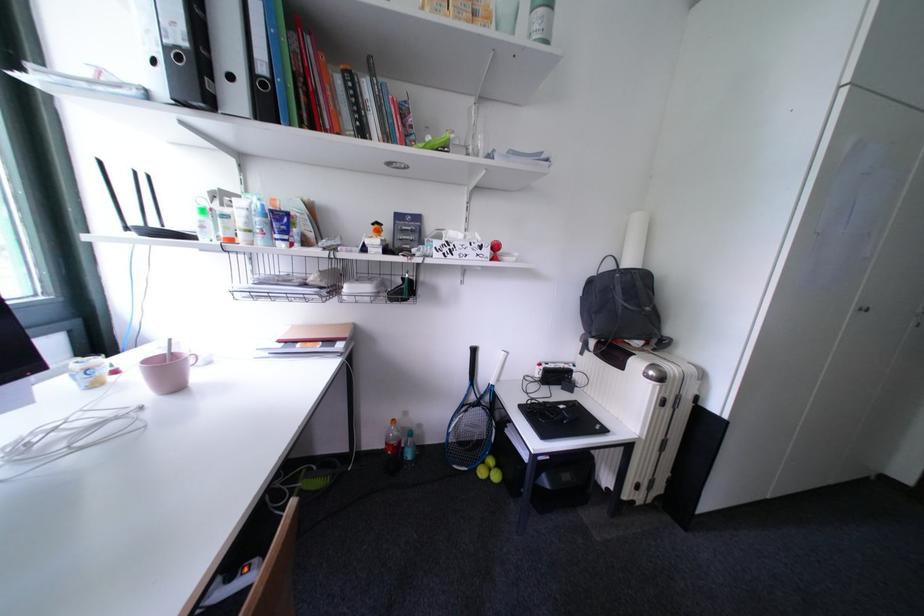
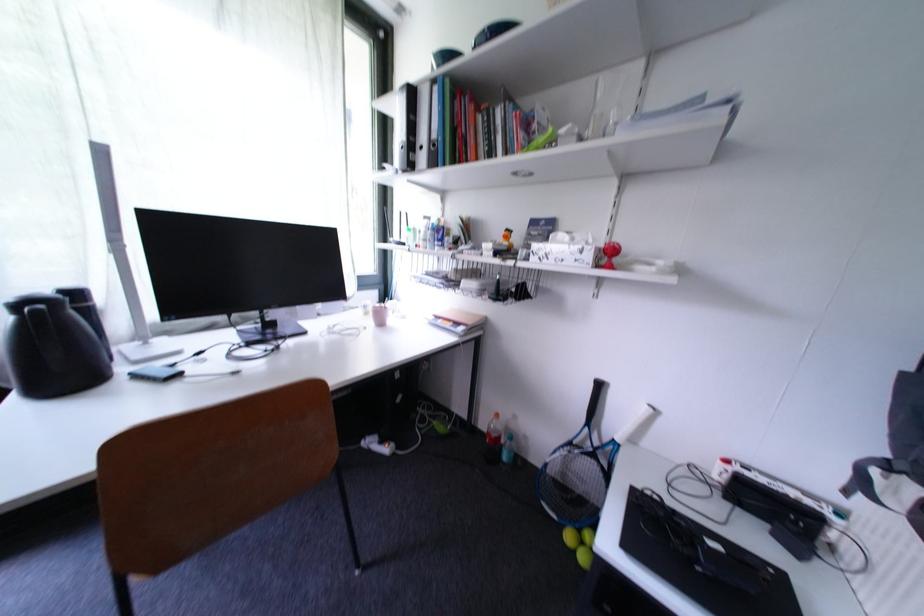
In the second image, find the point that corresponds to [490,475] in the first image.

(578, 540)